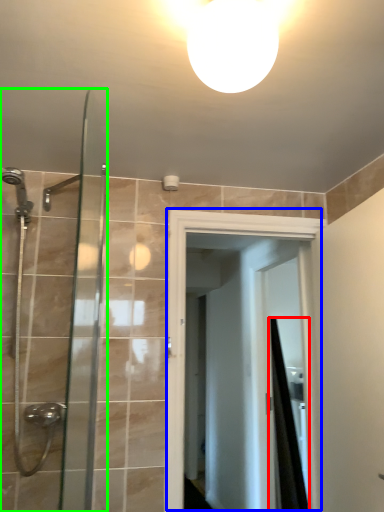
Question: Considering the real-world distances, which object is farthest from shower curtain (highlighted by a red box)? screen door (highlighted by a blue box) or shower door (highlighted by a green box)?

Choices:
 (A) screen door
 (B) shower door

Answer: (B)